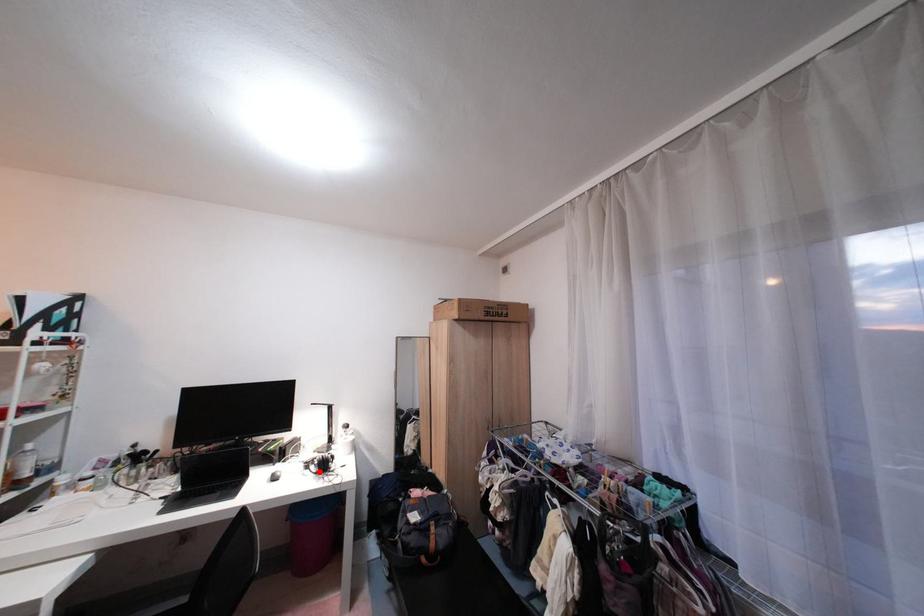
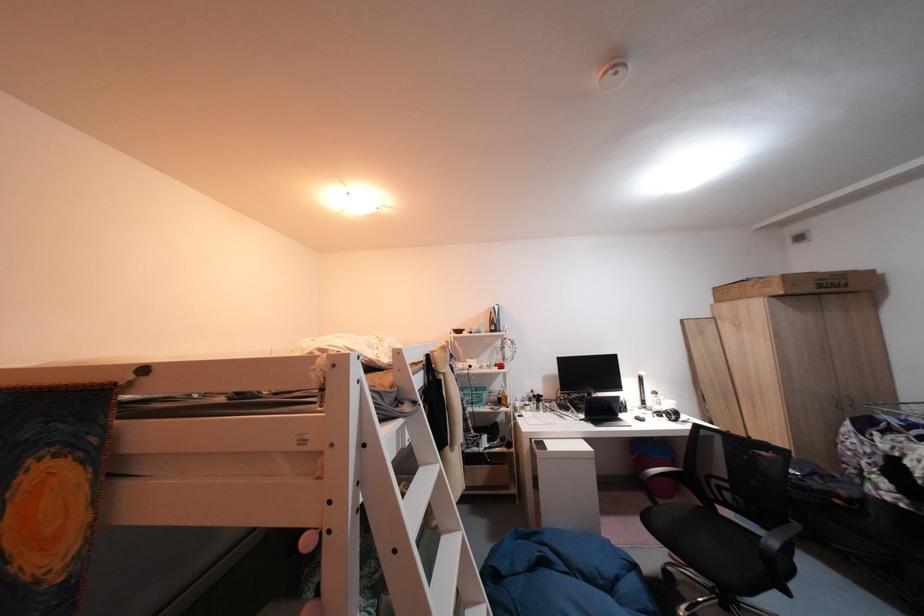
Question: I am providing you with two images of the same scene from different viewpoints. A red point is marked on the first image. Is the red point's position out of view in image 2?

Choices:
 (A) Yes
 (B) No

Answer: (A)